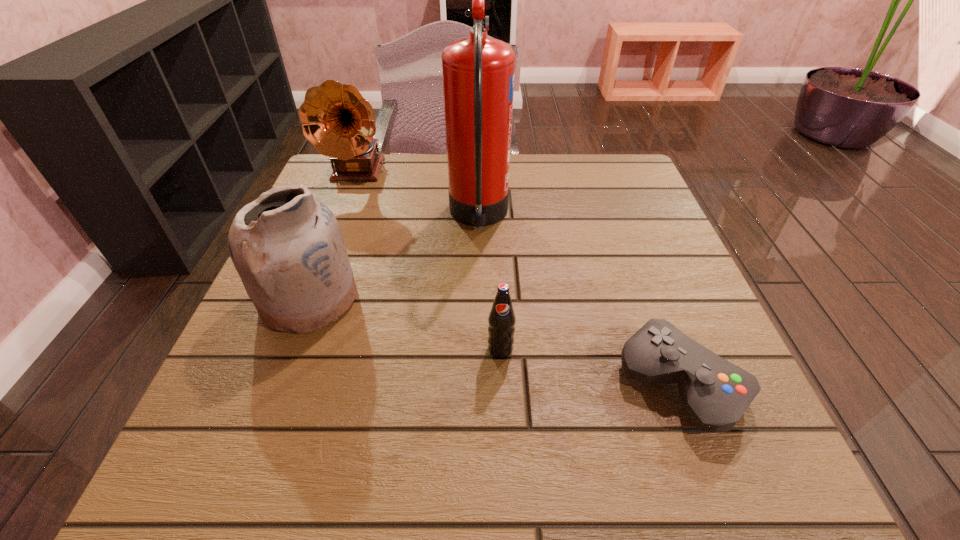
The height and width of the screenshot is (540, 960). Identify the location of the tallest object. coord(478,71).

Locate an element on the screen. phonograph_record is located at coordinates (336, 119).

This screenshot has width=960, height=540. Find the location of `pottery`. pottery is located at coordinates (287, 247).

What are the coordinates of `the second shortest object` in the screenshot? It's located at (501, 319).

Where is `the rightmost object`? the rightmost object is located at coordinates (715, 393).

I want to click on control, so (715, 393).

I want to click on blank space located on the surface of the tallest object, so click(x=658, y=217).

Locate an element on the screen. The width and height of the screenshot is (960, 540). vacant area situated 0.250m on the horn of the phonograph_record is located at coordinates tap(324, 261).

You are a GUI agent. You are given a task and a screenshot of the screen. Output one action in this format:
    pyautogui.click(x=<x>, y=<y>)
    Task: Click on the free location located 0.060m on the back of the pottery
    
    Given the screenshot: What is the action you would take?
    pyautogui.click(x=329, y=245)

Image resolution: width=960 pixels, height=540 pixels. Identify the location of free space located 0.050m on the front label of the fourth tallest object. (502, 387).